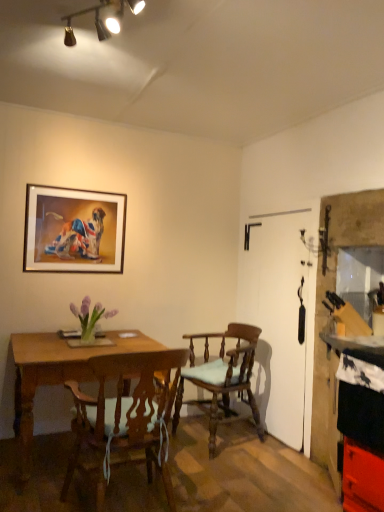
Question: In terms of width, does wooden framed picture at upper left look wider or thinner when compared to purple glass vase at center?

Choices:
 (A) thin
 (B) wide

Answer: (A)

Question: Based on their positions, is wooden framed picture at upper left located to the left or right of purple glass vase at center?

Choices:
 (A) left
 (B) right

Answer: (A)

Question: Considering the real-world distances, which object is farthest from the wooden table at left?

Choices:
 (A) smooth black countertop at right
 (B) wooden chair with cushion at center, which ranks as the second chair in front-to-back order
 (C) wooden framed picture at upper left
 (D) wooden chair with cushion at center, positioned as the second chair in back-to-front order
 (E) purple glass vase at center

Answer: (A)

Question: Which object is positioned closest to the purple glass vase at center?

Choices:
 (A) wooden chair with cushion at center, which is the first chair from front to back
 (B) smooth black countertop at right
 (C) wooden framed picture at upper left
 (D) wooden chair with cushion at center, which ranks as the second chair in front-to-back order
 (E) wooden table at left

Answer: (E)